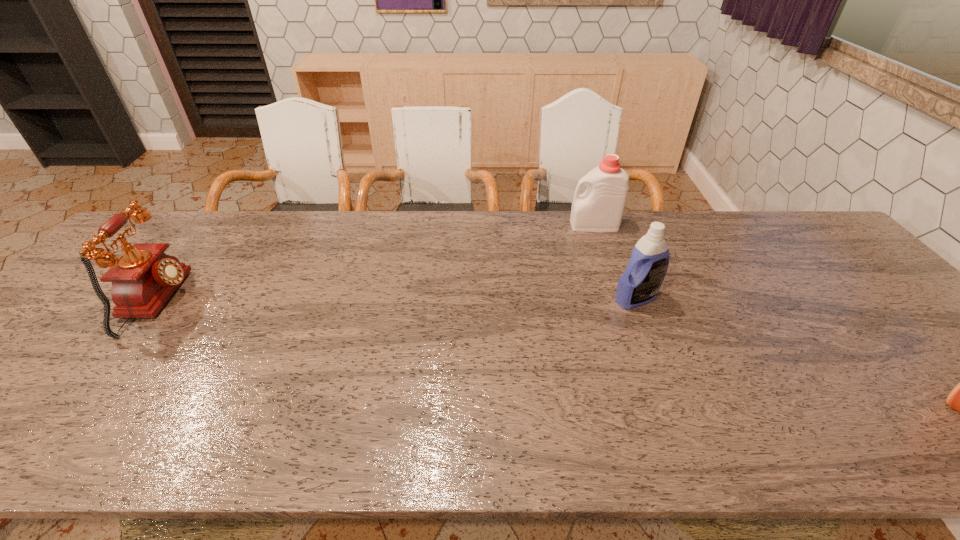
I want to click on the farthest object, so click(x=600, y=208).

Locate an element on the screen. This screenshot has height=540, width=960. the leftmost object is located at coordinates (143, 279).

Find the location of a particular element. The image size is (960, 540). the second farthest detergent is located at coordinates (645, 272).

The height and width of the screenshot is (540, 960). What are the coordinates of `vacant space situated 0.050m on the handle side of the farthest detergent` in the screenshot? It's located at (554, 225).

The width and height of the screenshot is (960, 540). What are the coordinates of `vacant area located on the handle side of the farthest detergent` in the screenshot? It's located at (490, 225).

Image resolution: width=960 pixels, height=540 pixels. I want to click on vacant space located on the handle side of the farthest detergent, so click(x=536, y=225).

Where is `free spot located on the dial of the telephone`? free spot located on the dial of the telephone is located at coordinates (313, 302).

In order to click on vacant space located on the right of the second nearest detergent in this screenshot , I will do `click(688, 299)`.

Locate an element on the screen. object that is at the far edge is located at coordinates (600, 208).

You are a GUI agent. You are given a task and a screenshot of the screen. Output one action in this format:
    pyautogui.click(x=<x>, y=<y>)
    Task: Click on the vacant space at the far edge of the desktop
    
    Given the screenshot: What is the action you would take?
    pyautogui.click(x=347, y=233)